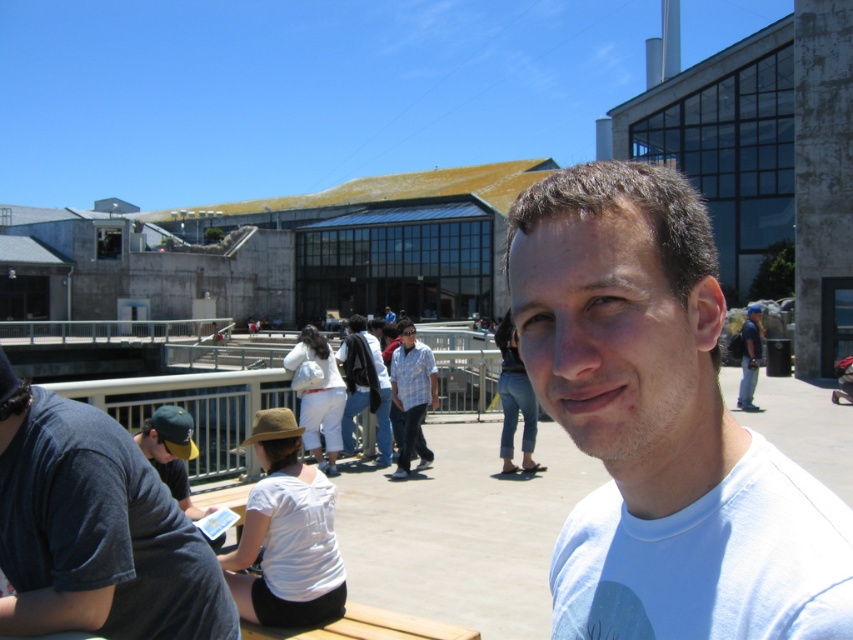
Question: Among these points, which one is nearest to the camera?

Choices:
 (A) (85, 602)
 (B) (431, 360)
 (C) (759, 330)

Answer: (A)

Question: Is the position of dark blue t-shirt at left less distant than that of blue denim jeans at center?

Choices:
 (A) no
 (B) yes

Answer: (B)

Question: Which point is closer to the camera taking this photo?

Choices:
 (A) (425, 364)
 (B) (105, 541)
 (C) (558, 314)

Answer: (C)

Question: Which of the following is the closest to the observer?

Choices:
 (A) blue denim jeans at center
 (B) plaid shirt at center
 (C) dark blue t-shirt at left
 (D) white cotton t-shirt at center

Answer: (D)

Question: Is dark blue t-shirt at left wider than blue denim jeans at center?

Choices:
 (A) yes
 (B) no

Answer: (A)

Question: Considering the relative positions of dark blue t-shirt at left and plaid shirt at center in the image provided, where is dark blue t-shirt at left located with respect to plaid shirt at center?

Choices:
 (A) below
 (B) above

Answer: (B)